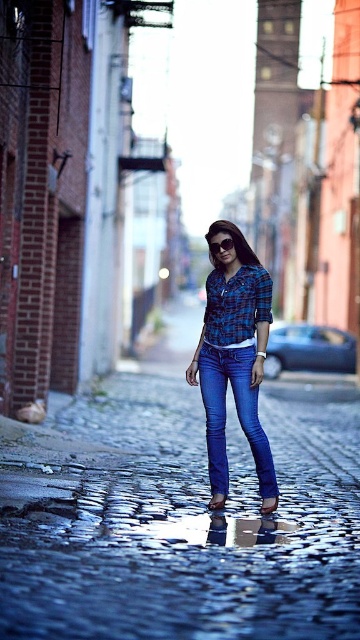
You are a fashion designer observing the person in the alleyway. You need to determine which item of clothing or accessory is larger in size between the denim jeans at center and the transparent plastic goggles at center. Which one is bigger?

The denim jeans at center is bigger than transparent plastic goggles at center.

You are a photographer trying to capture the reflection of the shiny cobblestone street at center in your shot. Since the denim jeans at center are blocking the view, can you move to the right to get a clear reflection?

The shiny cobblestone street at center is to the left of denim jeans at center, so moving to the right might allow you to capture the reflection without obstruction from the jeans.